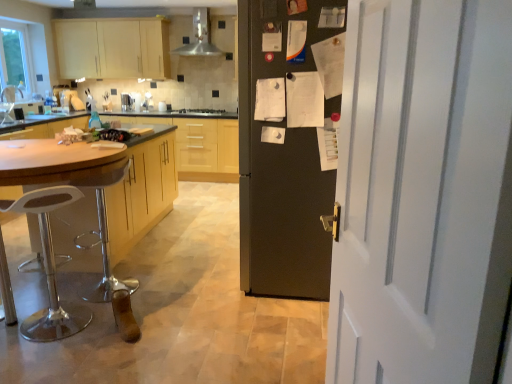
The height and width of the screenshot is (384, 512). I want to click on vacant space situated on the left part of matte black fridge at center, so click(x=191, y=277).